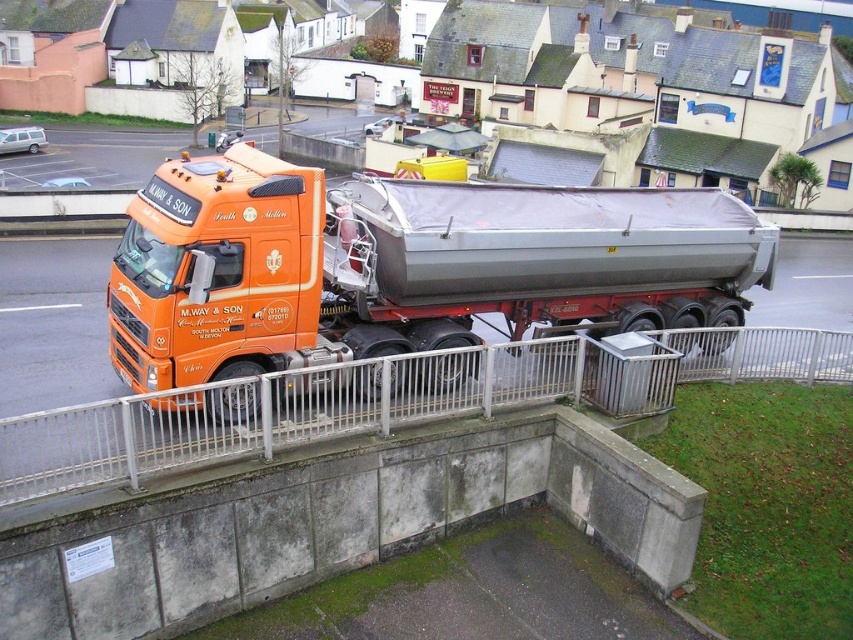
You are standing at point (22, 429) and want to move to point (334, 326). Based on the truck and its surroundings, is the path directly between these two points obstructed by the truck?

Point (334, 326) is behind point (22, 429), so the path between them is obstructed by the truck.

You are a delivery driver who needs to pass under a bridge that has a height restriction of 4 meters. You are currently next to the white metal rail at center. Can you safely drive the orange matte truck at center under the bridge without hitting the structure?

The orange matte truck at center is taller than the white metal rail at center. Since the white metal rail at center is next to you, and the truck is taller than it, the truck exceeds the 4 meter height restriction, so it cannot safely pass under the bridge without hitting the structure.